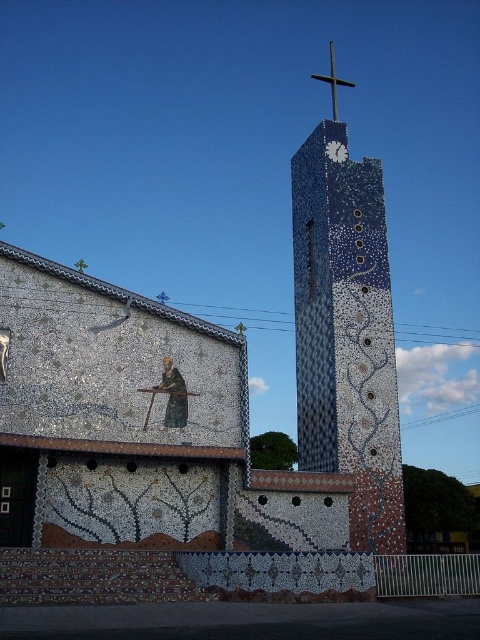
Which of these two, blue mosaic tower at center or metallic cross at upper center, stands shorter?

metallic cross at upper center

Which is below, blue mosaic tower at center or metallic cross at upper center?

blue mosaic tower at center is lower down.

Between point (314, 392) and point (347, 84), which one is positioned behind?

Positioned behind is point (347, 84).

Locate an element on the screen. This screenshot has width=480, height=640. blue mosaic tower at center is located at coordinates (346, 332).

Does blue mosaic tower at center have a greater width compared to white mosaic clock at upper center?

Yes, blue mosaic tower at center is wider than white mosaic clock at upper center.

Between point (362, 452) and point (338, 156), which one is positioned in front?

Point (362, 452) is more forward.

Find the location of a particular element. Image resolution: width=480 pixels, height=640 pixels. blue mosaic tower at center is located at coordinates (346, 332).

Is metallic cross at upper center thinner than white mosaic clock at upper center?

In fact, metallic cross at upper center might be wider than white mosaic clock at upper center.

Does metallic cross at upper center have a smaller size compared to white mosaic clock at upper center?

Actually, metallic cross at upper center might be larger than white mosaic clock at upper center.

What do you see at coordinates (333, 81) in the screenshot?
I see `metallic cross at upper center` at bounding box center [333, 81].

The width and height of the screenshot is (480, 640). What are the coordinates of `metallic cross at upper center` in the screenshot? It's located at (333, 81).